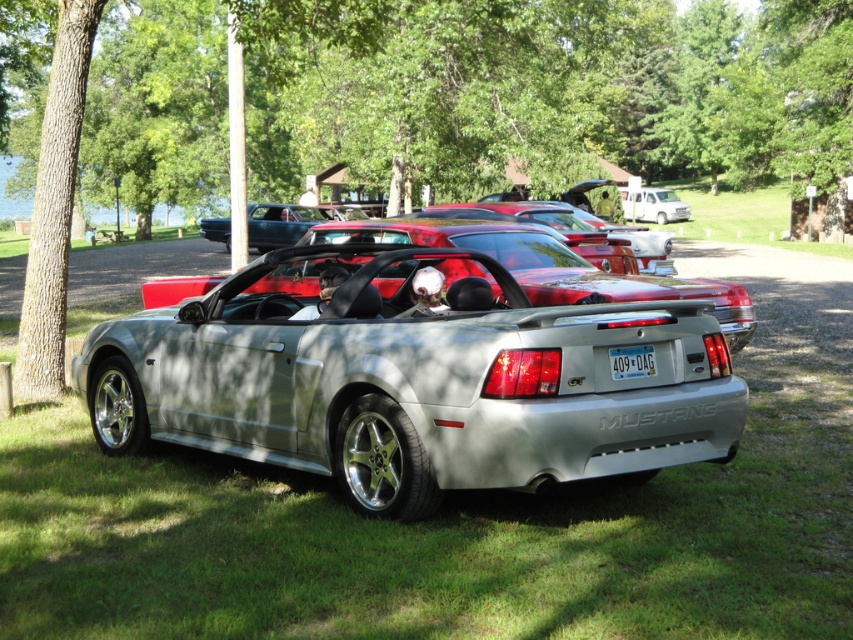
Question: Which object is positioned farthest from the silver metallic convertible at center?

Choices:
 (A) white matte van at upper center
 (B) white plastic license plate at center

Answer: (A)

Question: Which object is positioned farthest from the white matte van at upper center?

Choices:
 (A) silver metallic convertible at center
 (B) green grass at center

Answer: (A)

Question: Among these objects, which one is farthest from the camera?

Choices:
 (A) silver metallic convertible at center
 (B) white plastic license plate at center

Answer: (B)

Question: Is green grass at center behind white plastic license plate at center?

Choices:
 (A) yes
 (B) no

Answer: (B)

Question: Can you confirm if green grass at center is positioned to the right of white matte van at upper center?

Choices:
 (A) yes
 (B) no

Answer: (B)

Question: Can you confirm if white matte van at upper center is positioned to the left of white plastic license plate at center?

Choices:
 (A) yes
 (B) no

Answer: (B)